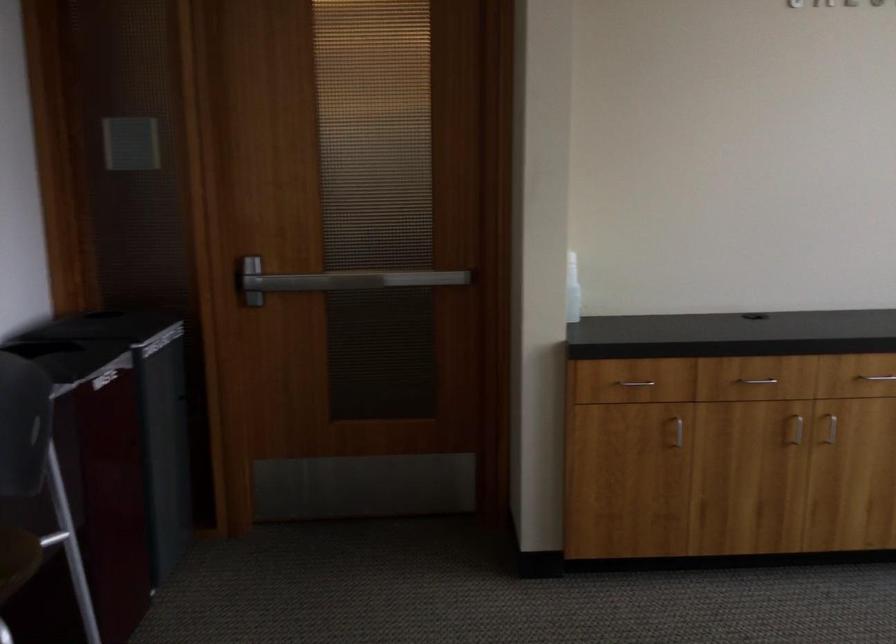
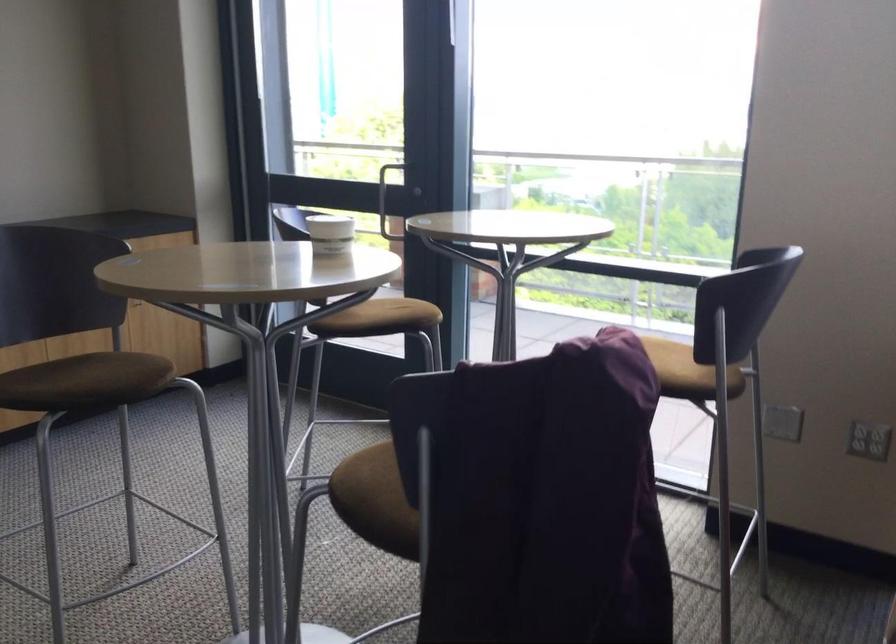
Question: How did the camera likely rotate?

Choices:
 (A) Left
 (B) Right
 (C) Up
 (D) Down

Answer: (B)